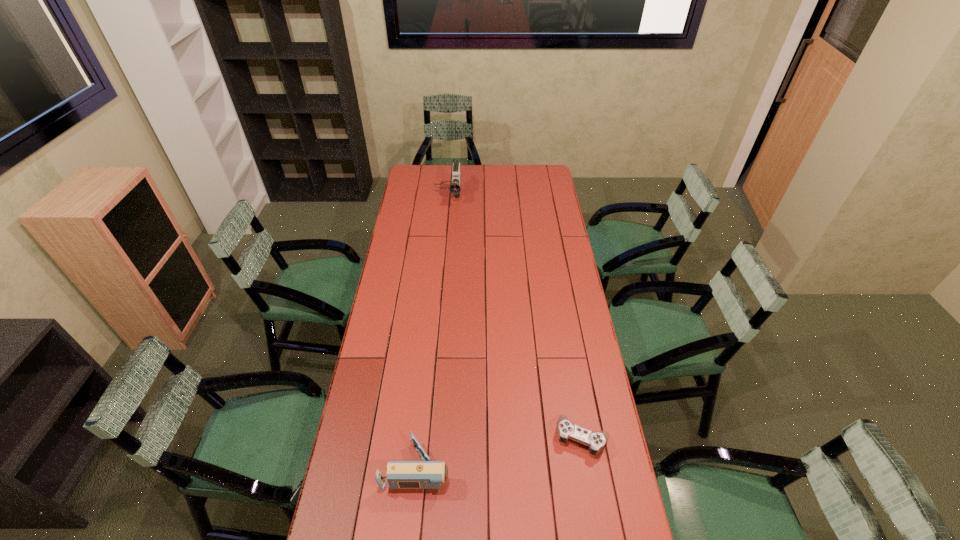
I want to click on vacant space that is in between the second tallest object and the farthest object, so click(x=433, y=332).

The height and width of the screenshot is (540, 960). I want to click on unoccupied area between the rightmost object and the shorter camcorder, so click(500, 452).

Locate an element on the screen. This screenshot has width=960, height=540. empty space between the farthest object and the shorter camcorder is located at coordinates (433, 332).

Find the location of a particular element. The height and width of the screenshot is (540, 960). blank region between the rightmost object and the taller camcorder is located at coordinates (515, 317).

Identify the location of vacant point located between the shorter camcorder and the control. (500, 452).

Locate an element on the screen. Image resolution: width=960 pixels, height=540 pixels. object that is the closest to the tallest object is located at coordinates (596, 441).

Select which object is the closest to the second shortest object. Please provide its 2D coordinates. Your answer should be formatted as a tuple, i.e. [(x, y)], where the tuple contains the x and y coordinates of a point satisfying the conditions above.

[(596, 441)]

You are a GUI agent. You are given a task and a screenshot of the screen. Output one action in this format:
    pyautogui.click(x=<x>, y=<y>)
    Task: Click on the free spot that satisfies the following two spatial constraints: 1. on the recording direction of the rightmost object; 2. on the left side of the taller camcorder
    The height and width of the screenshot is (540, 960).
    Given the screenshot: What is the action you would take?
    pyautogui.click(x=425, y=437)

Where is `vacant area in the image that satisfies the following two spatial constraints: 1. on the recording direction of the rightmost object; 2. on the left side of the tallest object`? vacant area in the image that satisfies the following two spatial constraints: 1. on the recording direction of the rightmost object; 2. on the left side of the tallest object is located at coordinates (425, 437).

This screenshot has height=540, width=960. I want to click on free space that satisfies the following two spatial constraints: 1. on the recording direction of the taller camcorder; 2. on the side of the second shortest object with the flip-out screen, so click(x=422, y=467).